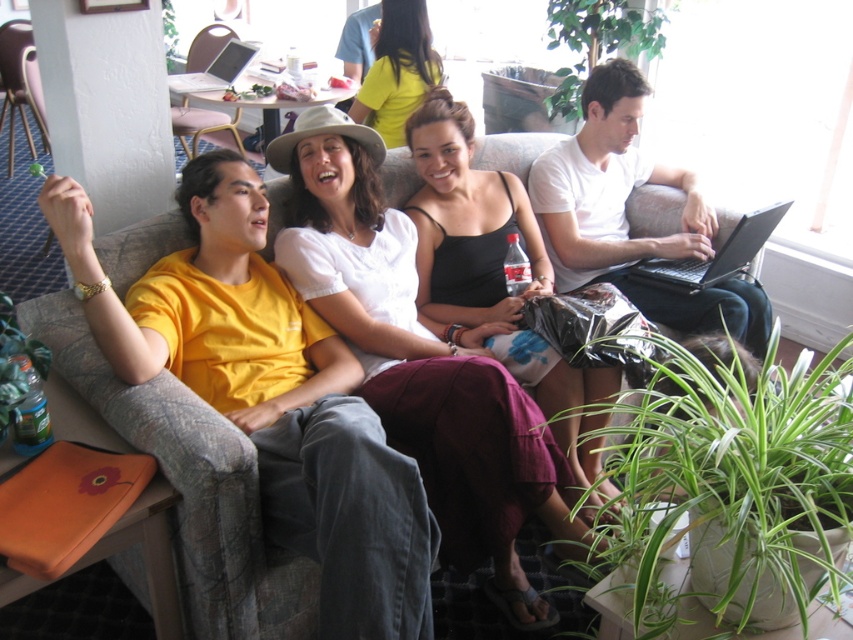
Can you confirm if black plastic laptop at right is positioned to the right of silver metallic laptop at upper left?

Correct, you'll find black plastic laptop at right to the right of silver metallic laptop at upper left.

Is black plastic laptop at right taller than silver metallic laptop at upper left?

No.

Locate an element on the screen. black plastic laptop at right is located at coordinates (714, 253).

Is black satin dress at center further to the viewer compared to matte yellow shirt at center?

No, black satin dress at center is closer to the viewer.

Does point (527, 381) lie in front of point (403, 4)?

Yes, it is.

Where is `black satin dress at center`? This screenshot has width=853, height=640. black satin dress at center is located at coordinates (466, 221).

In the scene shown: Does black satin dress at center have a smaller size compared to silver metallic laptop at upper left?

No, black satin dress at center is not smaller than silver metallic laptop at upper left.

Between black satin dress at center and silver metallic laptop at upper left, which one is positioned lower?

black satin dress at center

Which is behind, point (579, 394) or point (218, 58)?

Point (218, 58)

Where is `black satin dress at center`? The width and height of the screenshot is (853, 640). black satin dress at center is located at coordinates (466, 221).